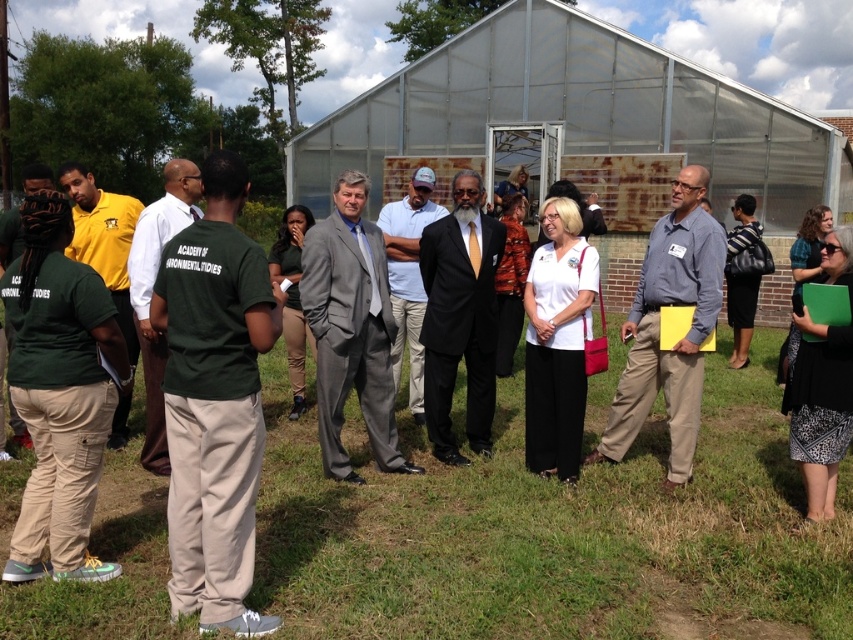
Question: Estimate the real-world distances between objects in this image. Which object is closer to the black satin suit at center?

Choices:
 (A) green matte shirt at left
 (B) gray fabric shirt at center

Answer: (B)

Question: Which of these objects is positioned closest to the green uniform at center?

Choices:
 (A) gray fabric shirt at center
 (B) green cotton shirt at center
 (C) matte yellow shirt at left
 (D) green matte shirt at left

Answer: (C)

Question: In this image, where is green uniform at center located relative to matte yellow shirt at left?

Choices:
 (A) right
 (B) left

Answer: (A)

Question: Can you confirm if gray fabric shirt at center is positioned below green uniform at center?

Choices:
 (A) no
 (B) yes

Answer: (B)

Question: Which of these objects is positioned farthest from the light blue shirt at center?

Choices:
 (A) gray fabric shirt at center
 (B) green uniform at center
 (C) black satin suit at center

Answer: (B)

Question: Observing the image, what is the correct spatial positioning of gray suit at center in reference to matte yellow shirt at left?

Choices:
 (A) below
 (B) above

Answer: (A)